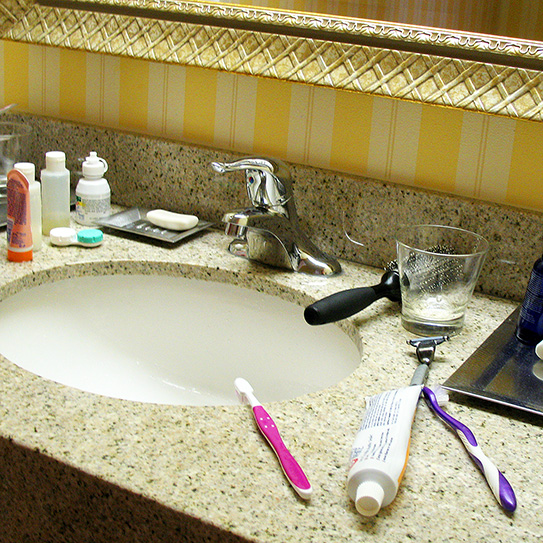
Locate an element on the screen. faucet is located at coordinates click(x=237, y=219).